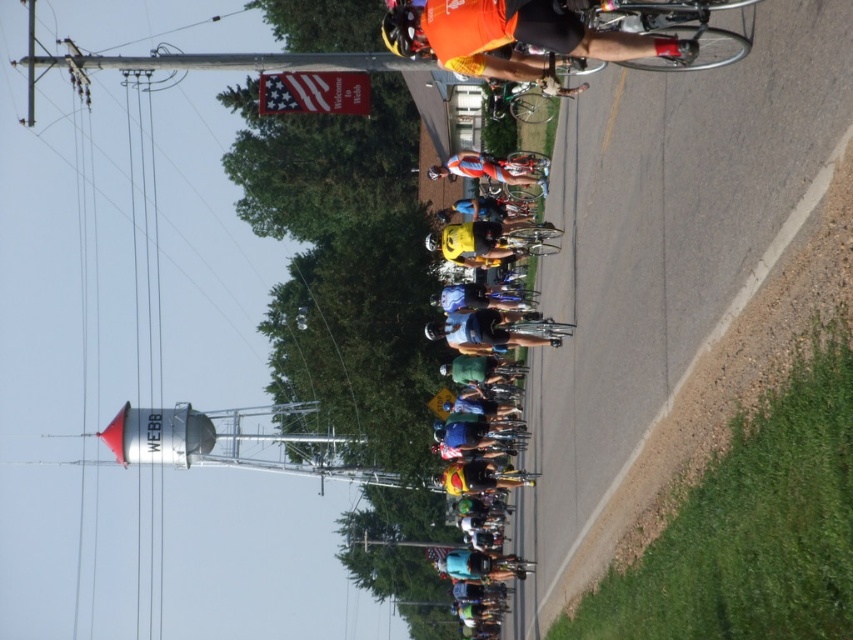
Question: Estimate the real-world distances between objects in this image. Which object is farther from the american flag banner at upper center?

Choices:
 (A) shiny orange helmet at center
 (B) orange jersey cyclist at center

Answer: (A)

Question: Is orange jersey cyclist at center thinner than shiny orange helmet at center?

Choices:
 (A) yes
 (B) no

Answer: (B)

Question: Is american flag banner at upper center bigger than orange jersey cyclist at center?

Choices:
 (A) no
 (B) yes

Answer: (A)

Question: Can you confirm if american flag banner at upper center is wider than orange jersey cyclist at center?

Choices:
 (A) no
 (B) yes

Answer: (B)

Question: Which point is farther to the camera?

Choices:
 (A) (529, 152)
 (B) (260, 90)

Answer: (B)

Question: Which of the following is the farthest from the observer?

Choices:
 (A) coord(270,83)
 (B) coord(517,177)

Answer: (A)